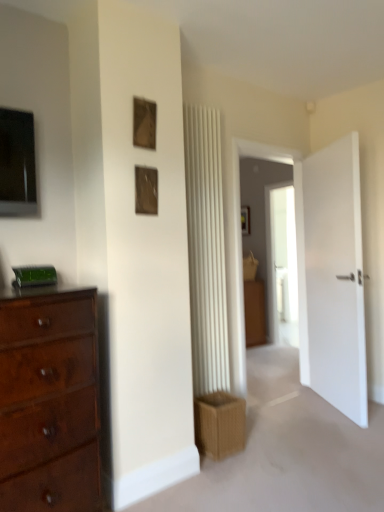
Locate an element on the screen. Image resolution: width=384 pixels, height=512 pixels. wooden picture frame at upper center, which is the second picture frame from top to bottom is located at coordinates (146, 190).

Based on the photo, measure the distance between point (138, 188) and camera.

Point (138, 188) is 2.15 meters away from camera.

Where is `mahogany wood dresser at left`? The height and width of the screenshot is (512, 384). mahogany wood dresser at left is located at coordinates (49, 403).

Would you consider brown cardboard crate at lower center to be distant from wooden picture frame at upper center, which is the first picture frame in bottom-to-top order?

That's right, there is a large distance between brown cardboard crate at lower center and wooden picture frame at upper center, which is the first picture frame in bottom-to-top order.

Who is taller, brown cardboard crate at lower center or wooden picture frame at upper center, which is the second picture frame from top to bottom?

brown cardboard crate at lower center is taller.

Considering the relative positions of brown cardboard crate at lower center and wooden picture frame at upper center, which is the first picture frame in bottom-to-top order, in the image provided, is brown cardboard crate at lower center in front of wooden picture frame at upper center, which is the first picture frame in bottom-to-top order,?

No, it is behind wooden picture frame at upper center, which is the first picture frame in bottom-to-top order.

From a real-world perspective, is brown cardboard crate at lower center under wooden picture frame at upper center, which is the first picture frame in bottom-to-top order?

Yes, from a real-world perspective, brown cardboard crate at lower center is below wooden picture frame at upper center, which is the first picture frame in bottom-to-top order.

Which object is more forward, wooden frame at upper center, which is counted as the 2th picture frame, starting from the bottom, or wooden picture frame at upper center, which is the first picture frame in bottom-to-top order?

wooden frame at upper center, which is counted as the 2th picture frame, starting from the bottom, is in front.

Is point (154, 130) more distant than point (142, 197)?

Yes, point (154, 130) is behind point (142, 197).

From a real-world perspective, is wooden frame at upper center, the 1th picture frame when ordered from top to bottom, physically located above or below wooden picture frame at upper center, which is the first picture frame in bottom-to-top order?

Clearly, from a real-world perspective, wooden frame at upper center, the 1th picture frame when ordered from top to bottom, is above wooden picture frame at upper center, which is the first picture frame in bottom-to-top order.

Which is more to the right, wooden frame at upper center, which is counted as the 2th picture frame, starting from the bottom, or wooden picture frame at upper center, which is the first picture frame in bottom-to-top order?

From the viewer's perspective, wooden picture frame at upper center, which is the first picture frame in bottom-to-top order, appears more on the right side.

Relative to brown cardboard crate at lower center, is wooden frame at upper center, which is counted as the 2th picture frame, starting from the bottom, in front or behind?

In the image, wooden frame at upper center, which is counted as the 2th picture frame, starting from the bottom, appears in front of brown cardboard crate at lower center.

Considering the positions of objects wooden frame at upper center, the 1th picture frame when ordered from top to bottom, and brown cardboard crate at lower center in the image provided, who is more to the right, wooden frame at upper center, the 1th picture frame when ordered from top to bottom, or brown cardboard crate at lower center?

brown cardboard crate at lower center is more to the right.

Could you measure the distance between wooden frame at upper center, which is counted as the 2th picture frame, starting from the bottom, and brown cardboard crate at lower center?

wooden frame at upper center, which is counted as the 2th picture frame, starting from the bottom, is 5.43 feet away from brown cardboard crate at lower center.

Locate an element on the screen. crate below the wooden frame at upper center, which is counted as the 2th picture frame, starting from the bottom (from a real-world perspective) is located at coordinates (219, 424).

Is mahogany wood dresser at left positioned far away from wooden picture frame at upper center, which is the first picture frame in bottom-to-top order?

That's not correct — mahogany wood dresser at left is a little close to wooden picture frame at upper center, which is the first picture frame in bottom-to-top order.

From the image's perspective, does mahogany wood dresser at left appear lower than wooden picture frame at upper center, which is the first picture frame in bottom-to-top order?

Yes, from the image's perspective, mahogany wood dresser at left is below wooden picture frame at upper center, which is the first picture frame in bottom-to-top order.

Is mahogany wood dresser at left at the left side of wooden picture frame at upper center, which is the first picture frame in bottom-to-top order?

Yes, mahogany wood dresser at left is to the left of wooden picture frame at upper center, which is the first picture frame in bottom-to-top order.

Is mahogany wood dresser at left inside or outside of wooden picture frame at upper center, which is the first picture frame in bottom-to-top order?

mahogany wood dresser at left is outside wooden picture frame at upper center, which is the first picture frame in bottom-to-top order.

From the image's perspective, is wooden picture frame at upper center, which is the second picture frame from top to bottom, located beneath brown cardboard crate at lower center?

Actually, wooden picture frame at upper center, which is the second picture frame from top to bottom, appears above brown cardboard crate at lower center in the image.

Does wooden picture frame at upper center, which is the second picture frame from top to bottom, have a lesser width compared to brown cardboard crate at lower center?

Correct, the width of wooden picture frame at upper center, which is the second picture frame from top to bottom, is less than that of brown cardboard crate at lower center.

Does wooden picture frame at upper center, which is the first picture frame in bottom-to-top order, appear on the left side of brown cardboard crate at lower center?

Yes.

Which of these two, wooden picture frame at upper center, which is the second picture frame from top to bottom, or mahogany wood dresser at left, is wider?

mahogany wood dresser at left is wider.

Does wooden picture frame at upper center, which is the first picture frame in bottom-to-top order, come in front of mahogany wood dresser at left?

No.

I want to click on the chest of drawers located below the wooden picture frame at upper center, which is the second picture frame from top to bottom (from the image's perspective), so click(49, 403).

From the image's perspective, who appears lower, wooden picture frame at upper center, which is the first picture frame in bottom-to-top order, or mahogany wood dresser at left?

mahogany wood dresser at left is shown below in the image.

Between brown cardboard crate at lower center and mahogany wood dresser at left, which one has less height?

brown cardboard crate at lower center is shorter.

Considering the sizes of objects brown cardboard crate at lower center and mahogany wood dresser at left in the image provided, who is thinner, brown cardboard crate at lower center or mahogany wood dresser at left?

With smaller width is brown cardboard crate at lower center.

Identify the location of crate that appears below the mahogany wood dresser at left (from a real-world perspective). (219, 424).

Locate an element on the screen. The image size is (384, 512). crate behind the wooden picture frame at upper center, which is the second picture frame from top to bottom is located at coordinates (219, 424).

Identify the location of picture frame below the wooden frame at upper center, the 1th picture frame when ordered from top to bottom (from the image's perspective). This screenshot has width=384, height=512. (146, 190).

From the image, which object appears to be farther from brown cardboard crate at lower center, wooden picture frame at upper center, which is the first picture frame in bottom-to-top order, or mahogany wood dresser at left?

wooden picture frame at upper center, which is the first picture frame in bottom-to-top order, lies further to brown cardboard crate at lower center than the other object.

Considering their positions, is brown cardboard crate at lower center positioned further to wooden picture frame at upper center, which is the second picture frame from top to bottom, than wooden frame at upper center, the 1th picture frame when ordered from top to bottom?

brown cardboard crate at lower center is positioned further to the anchor wooden picture frame at upper center, which is the second picture frame from top to bottom.

From the image, which object appears to be nearer to mahogany wood dresser at left, wooden frame at upper center, which is counted as the 2th picture frame, starting from the bottom, or brown cardboard crate at lower center?

The object closer to mahogany wood dresser at left is brown cardboard crate at lower center.

When comparing their distances from wooden picture frame at upper center, which is the first picture frame in bottom-to-top order, does brown cardboard crate at lower center or mahogany wood dresser at left seem further?

brown cardboard crate at lower center lies further to wooden picture frame at upper center, which is the first picture frame in bottom-to-top order, than the other object.

Looking at the image, which one is located further to mahogany wood dresser at left, wooden frame at upper center, the 1th picture frame when ordered from top to bottom, or wooden picture frame at upper center, which is the second picture frame from top to bottom?

wooden frame at upper center, the 1th picture frame when ordered from top to bottom, is further to mahogany wood dresser at left.

From the image, which object appears to be farther from mahogany wood dresser at left, wooden picture frame at upper center, which is the first picture frame in bottom-to-top order, or wooden frame at upper center, which is counted as the 2th picture frame, starting from the bottom?

The object further to mahogany wood dresser at left is wooden frame at upper center, which is counted as the 2th picture frame, starting from the bottom.

Considering their positions, is wooden picture frame at upper center, which is the second picture frame from top to bottom, positioned further to wooden frame at upper center, the 1th picture frame when ordered from top to bottom, than brown cardboard crate at lower center?

brown cardboard crate at lower center is further to wooden frame at upper center, the 1th picture frame when ordered from top to bottom.

Looking at the image, which one is located closer to brown cardboard crate at lower center, wooden frame at upper center, which is counted as the 2th picture frame, starting from the bottom, or mahogany wood dresser at left?

Based on the image, mahogany wood dresser at left appears to be nearer to brown cardboard crate at lower center.

Identify the location of the chest of drawers between wooden picture frame at upper center, which is the second picture frame from top to bottom, and brown cardboard crate at lower center vertically. The image size is (384, 512). (49, 403).

Where is `chest of drawers between wooden frame at upper center, which is counted as the 2th picture frame, starting from the bottom, and brown cardboard crate at lower center from top to bottom`? This screenshot has width=384, height=512. chest of drawers between wooden frame at upper center, which is counted as the 2th picture frame, starting from the bottom, and brown cardboard crate at lower center from top to bottom is located at coordinates (49, 403).

Find the location of a particular element. This screenshot has width=384, height=512. picture frame between wooden frame at upper center, which is counted as the 2th picture frame, starting from the bottom, and mahogany wood dresser at left from top to bottom is located at coordinates (146, 190).

You are a GUI agent. You are given a task and a screenshot of the screen. Output one action in this format:
    pyautogui.click(x=<x>, y=<y>)
    Task: Click on the picture frame between wooden frame at upper center, which is counted as the 2th picture frame, starting from the bottom, and brown cardboard crate at lower center vertically
    Image resolution: width=384 pixels, height=512 pixels.
    Given the screenshot: What is the action you would take?
    pyautogui.click(x=146, y=190)